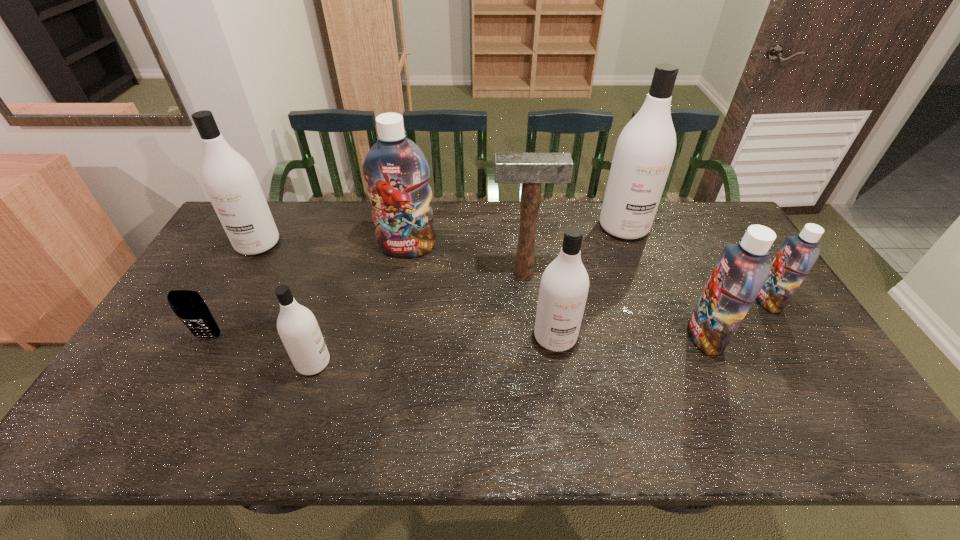
Find the location of a particular element. The image size is (960, 540). unoccupied position between the leftmost white shampoo and the leftmost blue shampoo is located at coordinates (333, 246).

Where is `vacant space that is in between the second blue shampoo from right to left and the mallet`? The width and height of the screenshot is (960, 540). vacant space that is in between the second blue shampoo from right to left and the mallet is located at coordinates 614,306.

This screenshot has height=540, width=960. Identify the location of unoccupied position between the leftmost blue shampoo and the sixth nearest object. (466, 261).

Locate an element on the screen. This screenshot has height=540, width=960. free space between the cellular telephone and the fourth object from left to right is located at coordinates (308, 293).

Identify the location of unoccupied area between the tallest object and the rightmost blue shampoo. This screenshot has width=960, height=540. (696, 264).

Identify the location of object that is the fifth closest to the cellular telephone. (564, 286).

Identify which object is located as the fifth nearest to the third white shampoo from right to left. Please provide its 2D coordinates. Your answer should be formatted as a tuple, i.e. [(x, y)], where the tuple contains the x and y coordinates of a point satisfying the conditions above.

[(564, 286)]

Identify which shampoo is located as the fourth nearest to the biggest blue shampoo. Please provide its 2D coordinates. Your answer should be formatted as a tuple, i.e. [(x, y)], where the tuple contains the x and y coordinates of a point satisfying the conditions above.

[(645, 149)]

Identify which shampoo is the seventh nearest to the shortest object. Please provide its 2D coordinates. Your answer should be formatted as a tuple, i.e. [(x, y)], where the tuple contains the x and y coordinates of a point satisfying the conditions above.

[(798, 254)]

Select which white shampoo appears as the closest to the smallest blue shampoo. Please provide its 2D coordinates. Your answer should be formatted as a tuple, i.e. [(x, y)], where the tuple contains the x and y coordinates of a point satisfying the conditions above.

[(645, 149)]